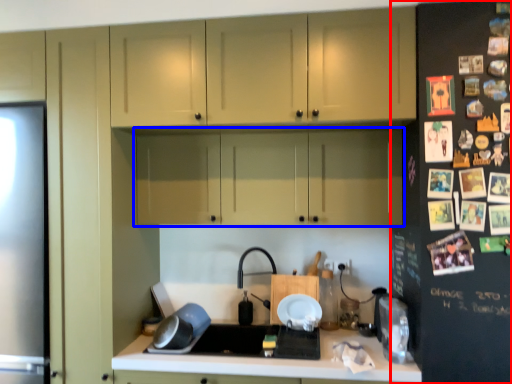
Question: Which object appears closest to the camera in this image, fridge (highlighted by a red box) or cabinetry (highlighted by a blue box)?

Choices:
 (A) fridge
 (B) cabinetry

Answer: (A)